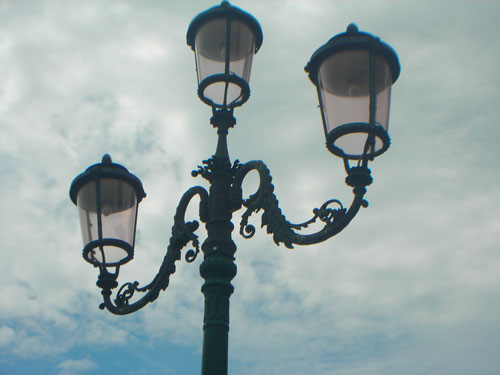
This screenshot has width=500, height=375. Find the location of `third light bulb`. third light bulb is located at coordinates (104, 204).